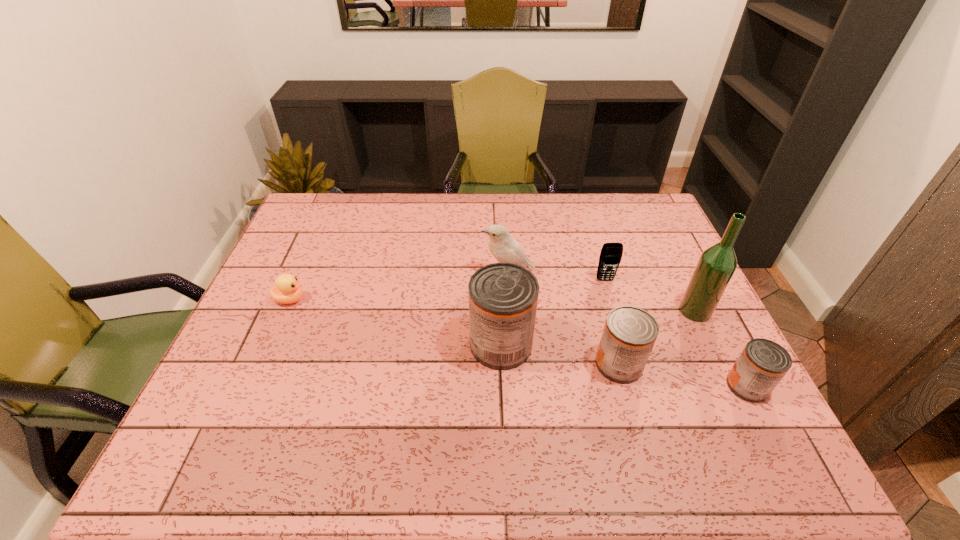
At what (x,y) coordinates should I click in order to perform the action: click on vacant area between the alcohol and the fifth shortest object. Please return your answer as a coordinate pair (x, y). Looking at the image, I should click on (601, 293).

In order to click on vacant space in between the second can from right to left and the rightmost can in this screenshot , I will do `click(683, 375)`.

You are a GUI agent. You are given a task and a screenshot of the screen. Output one action in this format:
    pyautogui.click(x=<x>, y=<y>)
    Task: Click on the vacant area that lies between the duckling and the fifth shortest object
    This screenshot has height=540, width=960.
    Given the screenshot: What is the action you would take?
    (398, 287)

I want to click on empty space between the tallest can and the second can from left to right, so click(560, 354).

The image size is (960, 540). Find the location of `object that is the closest to the tallest can`. object that is the closest to the tallest can is located at coordinates (629, 334).

Where is `object that is the fourth closest to the tallest can`? The image size is (960, 540). object that is the fourth closest to the tallest can is located at coordinates (717, 264).

Identify which can is the second closest to the tallest can. Please provide its 2D coordinates. Your answer should be formatted as a tuple, i.e. [(x, y)], where the tuple contains the x and y coordinates of a point satisfying the conditions above.

[(762, 364)]

Identify which can is located as the third nearest to the leftmost object. Please provide its 2D coordinates. Your answer should be formatted as a tuple, i.e. [(x, y)], where the tuple contains the x and y coordinates of a point satisfying the conditions above.

[(762, 364)]

The image size is (960, 540). I want to click on vacant area in the image that satisfies the following two spatial constraints: 1. on the face of the shortest object; 2. on the back side of the tallest object, so click(285, 311).

Find the location of a particular element. vacant point that satisfies the following two spatial constraints: 1. on the screen of the cellular telephone; 2. on the left side of the tallest object is located at coordinates (614, 311).